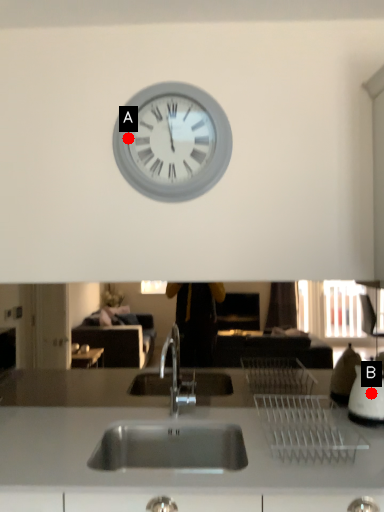
Question: Two points are circled on the image, labeled by A and B beside each circle. Which point appears closest to the camera in this image?

Choices:
 (A) A is closer
 (B) B is closer

Answer: (B)